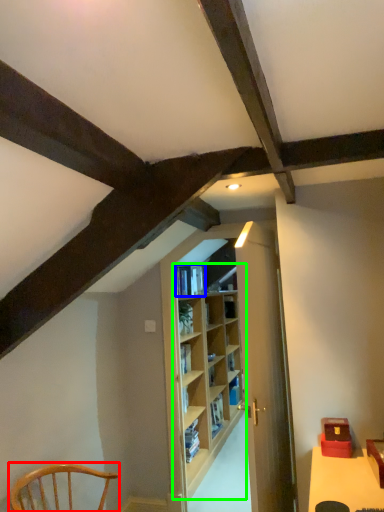
Question: Which object is positioned closest to chair (highlighted by a red box)? Select from book (highlighted by a blue box) and shelf (highlighted by a green box).

Choices:
 (A) book
 (B) shelf

Answer: (A)